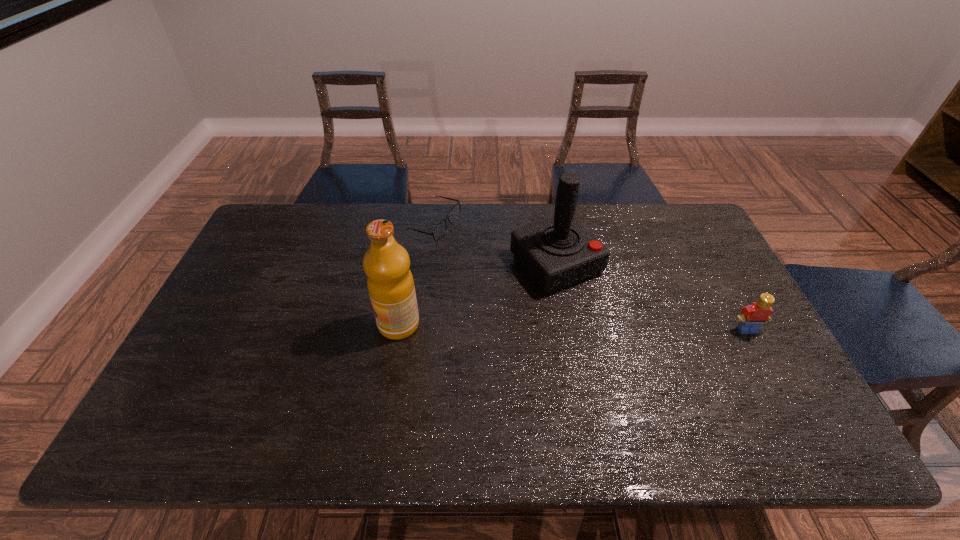
Identify the location of free space between the joystick and the second shortest object. (652, 296).

Select which object appears as the second closest to the third object from left to right. Please provide its 2D coordinates. Your answer should be formatted as a tuple, i.e. [(x, y)], where the tuple contains the x and y coordinates of a point satisfying the conditions above.

[(390, 283)]

Identify which object is the closest to the rightmost object. Please provide its 2D coordinates. Your answer should be formatted as a tuple, i.e. [(x, y)], where the tuple contains the x and y coordinates of a point satisfying the conditions above.

[(557, 252)]

The image size is (960, 540). I want to click on free location that satisfies the following two spatial constraints: 1. on the front side of the joystick; 2. on the left side of the spectacles, so click(x=430, y=264).

Where is `blank space that satisfies the following two spatial constraints: 1. on the front side of the spectacles; 2. on the left side of the joystick`? blank space that satisfies the following two spatial constraints: 1. on the front side of the spectacles; 2. on the left side of the joystick is located at coordinates (430, 264).

This screenshot has height=540, width=960. What are the coordinates of `free spot that satisfies the following two spatial constraints: 1. on the front side of the third object from left to right; 2. on the right side of the shortest object` in the screenshot? It's located at (430, 264).